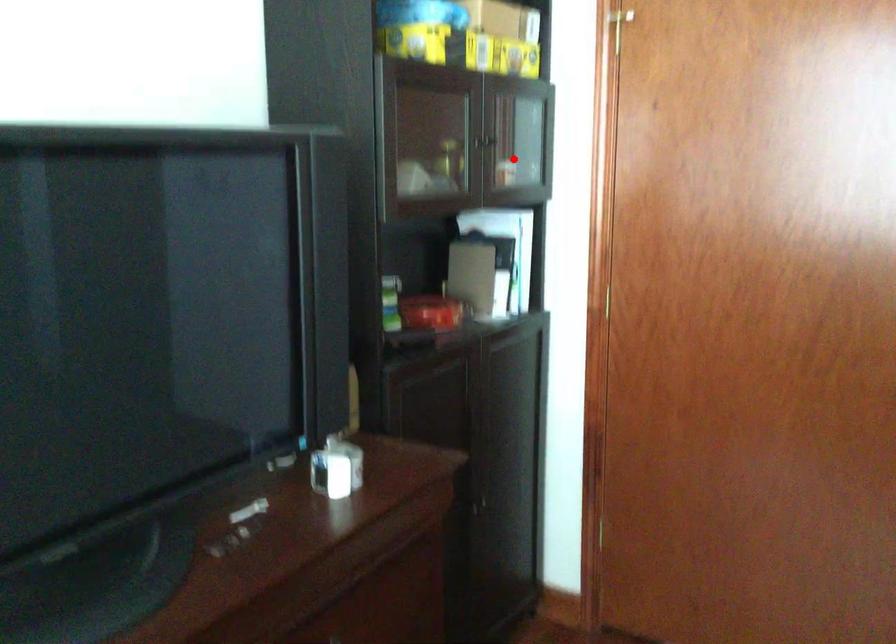
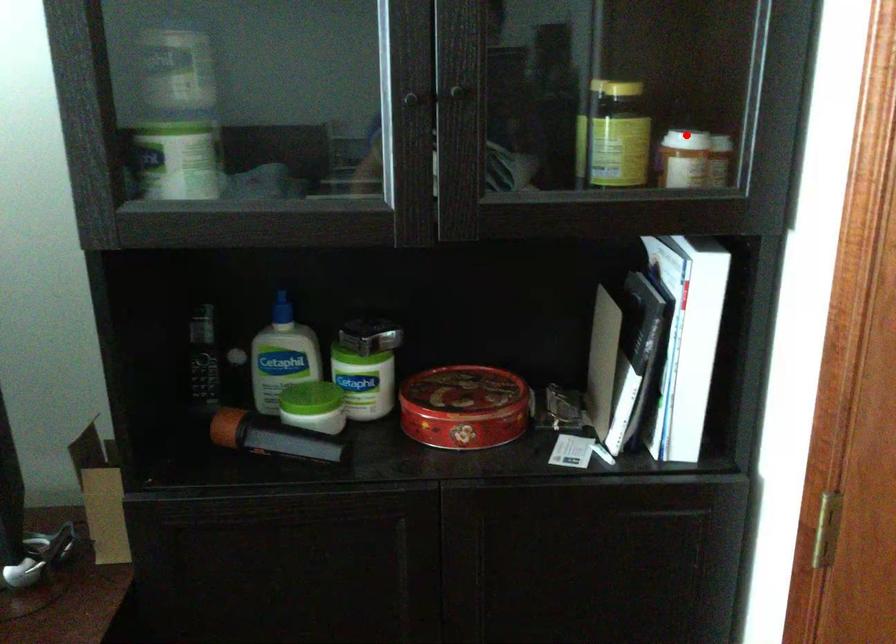
I am providing you with two images of the same scene from different viewpoints. A red point is marked on the first image and another point is marked on the second image. Does the point marked in image1 correspond to the same location as the one in image2?

Yes